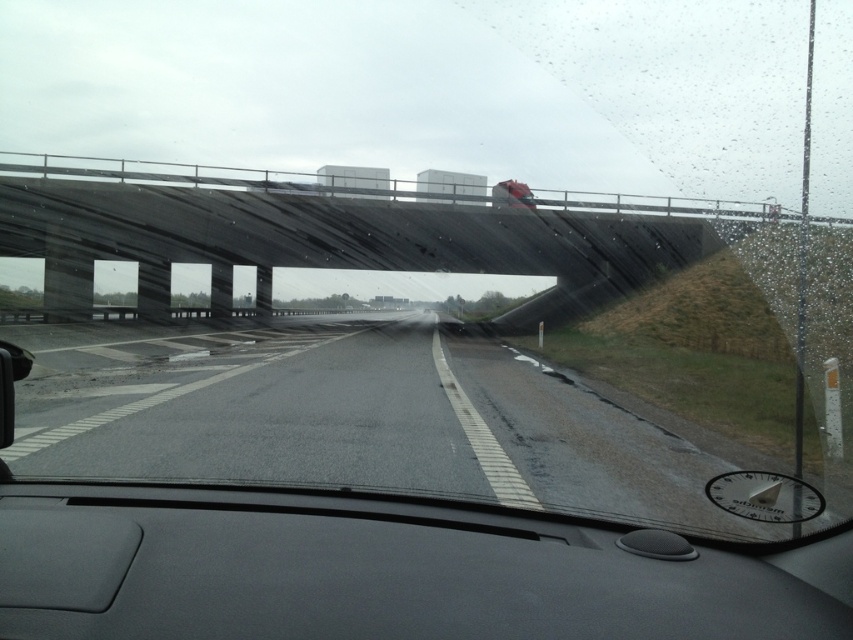
You are driving and need to keep your eyes on the road. Which object should you primarily focus on, the black matte dashboard at center or the asphalt road at center?

You should primarily focus on the asphalt road at center because the black matte dashboard at center is to its right, meaning the road is directly ahead in your line of sight while driving.